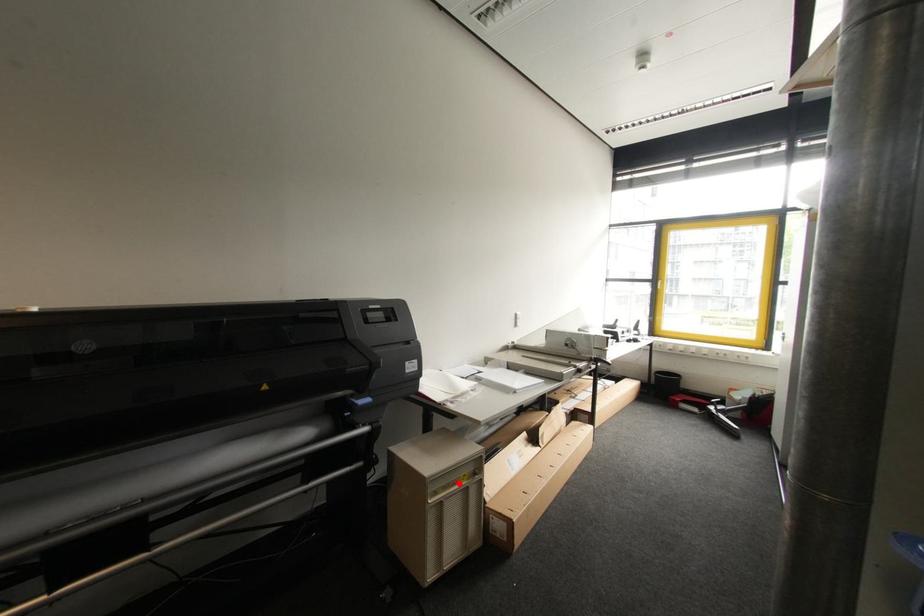
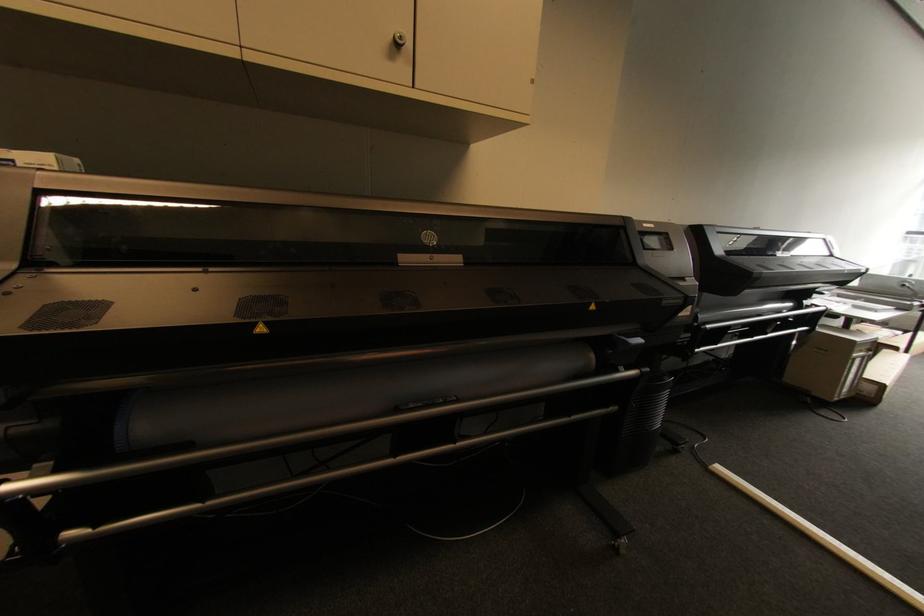
Question: I am providing you with two images of the same scene from different viewpoints. A red point is shown in image1. For the corresponding object point in image2, is it positioned nearer or farther from the camera?

Choices:
 (A) Nearer
 (B) Farther

Answer: (A)